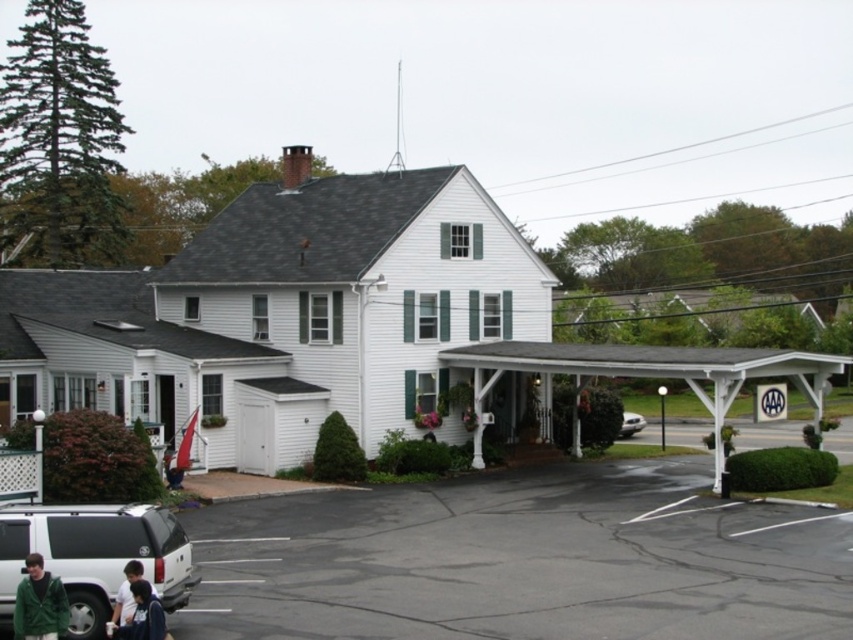
Question: Which point is farther from the camera taking this photo?

Choices:
 (A) (676, 509)
 (B) (627, 419)
 (C) (119, 586)
 (D) (62, 618)

Answer: (B)

Question: Considering the real-world distances, which object is closest to the silver metallic sedan at center?

Choices:
 (A) black asphalt parking lot at lower center
 (B) dark blue shirt at lower left
 (C) green fleece jacket at lower left
 (D) matte black suv at lower left

Answer: (A)

Question: Does black asphalt parking lot at lower center appear on the right side of matte black suv at lower left?

Choices:
 (A) yes
 (B) no

Answer: (A)

Question: Is the position of black asphalt parking lot at lower center less distant than that of green fleece jacket at lower left?

Choices:
 (A) no
 (B) yes

Answer: (A)

Question: Which point is farther to the camera?

Choices:
 (A) (624, 412)
 (B) (131, 614)
 (C) (44, 632)
 (D) (3, 602)

Answer: (A)

Question: Can you confirm if dark blue shirt at lower left is positioned to the right of silver metallic sedan at center?

Choices:
 (A) no
 (B) yes

Answer: (A)